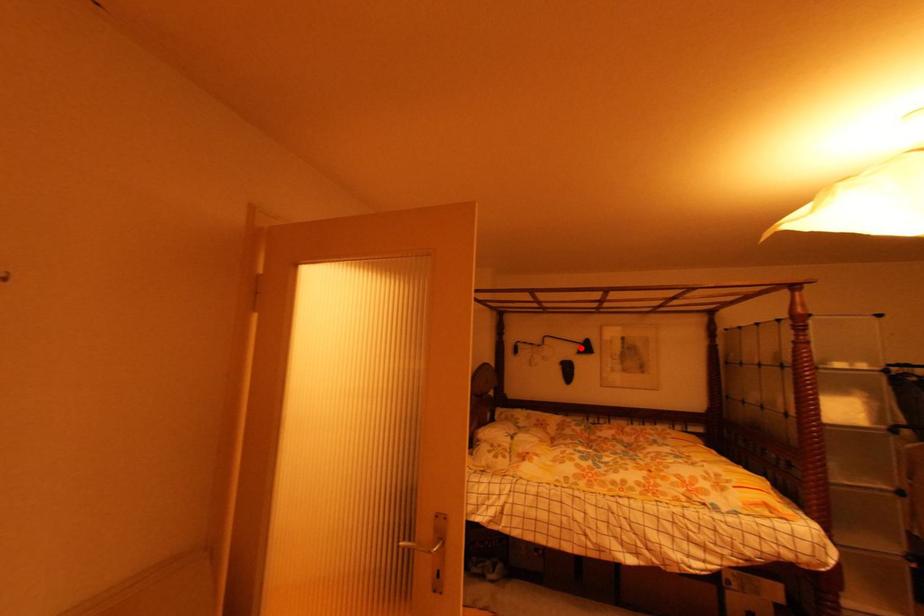
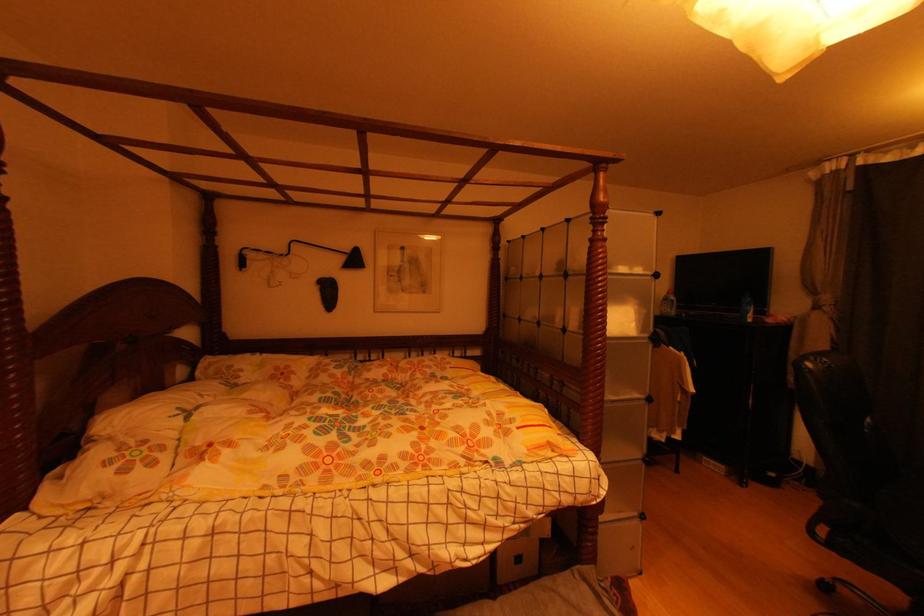
The point at the highlighted location is marked in the first image. Where is the corresponding point in the second image?

(346, 261)